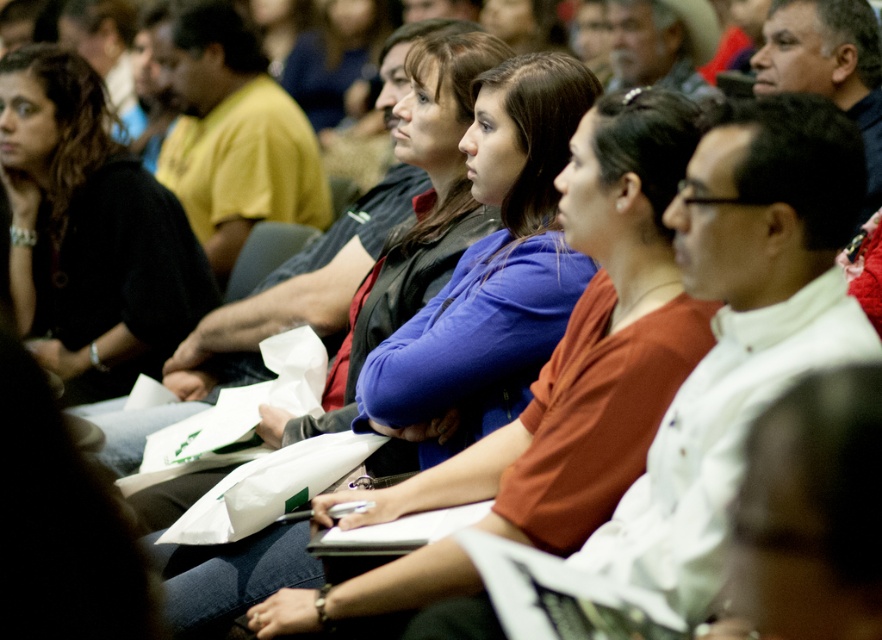
You are sitting in the front row of the auditorium and notice two attendees in the row ahead of you. One is wearing a blue matte shirt at center and the other a black sweater at left. From your perspective, which attendee is sitting to the right of the other?

The blue matte shirt at center is to the right of the black sweater at left.

You are sitting in the back row of the auditorium and want to see both the blue matte shirt at center and the yellow matte shirt at center clearly. Which one is more likely to block your view of the other?

The blue matte shirt at center is shorter than the yellow matte shirt at center, so the yellow matte shirt at center may block the view of the blue matte shirt at center if they are seated in front of you.